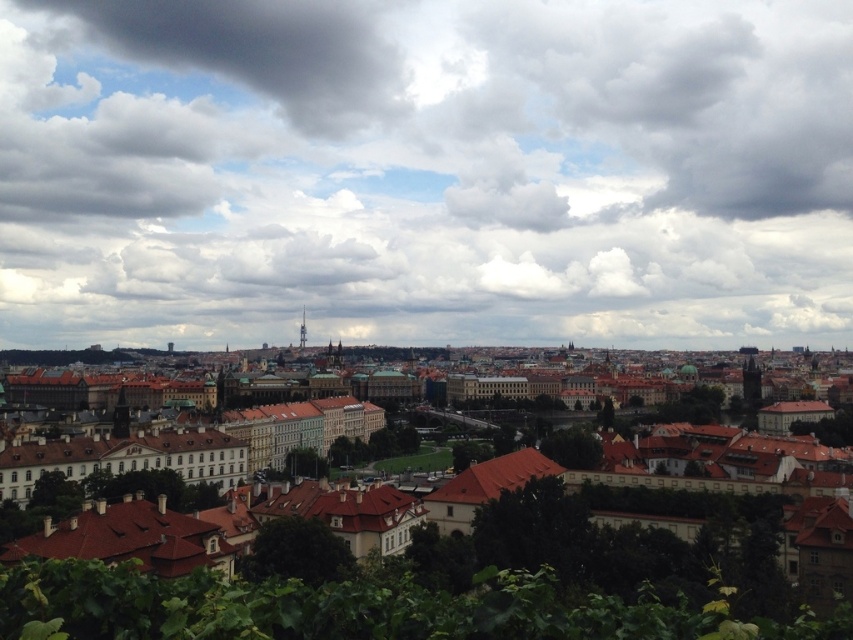
Where is `cloudy sky at center`? This screenshot has height=640, width=853. cloudy sky at center is located at coordinates (425, 172).

Who is more forward, (421, 234) or (265, 509)?

Point (265, 509) is more forward.

Locate an element on the screen. The height and width of the screenshot is (640, 853). cloudy sky at center is located at coordinates (425, 172).

The image size is (853, 640). Identify the location of cloudy sky at center. (425, 172).